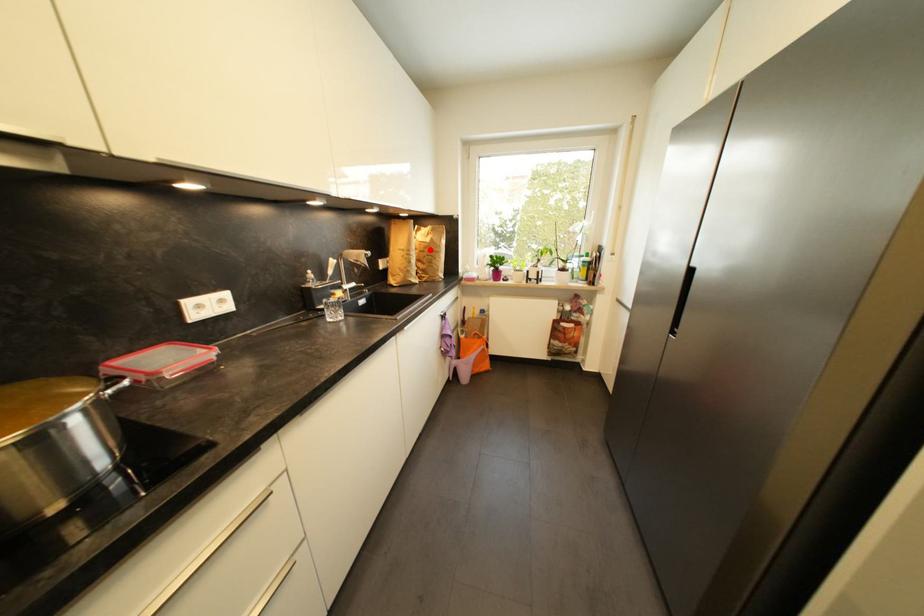
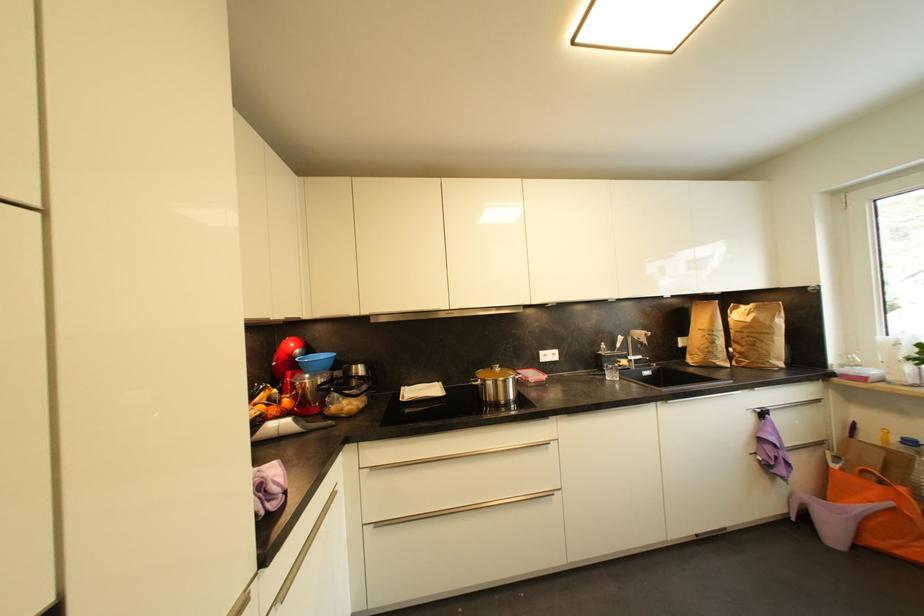
Question: I am providing you with two images of the same scene from different viewpoints. In image1, a red point is highlighted. Considering the same 3D point in image2, which of the following is correct?

Choices:
 (A) It is closer
 (B) It is farther

Answer: (B)